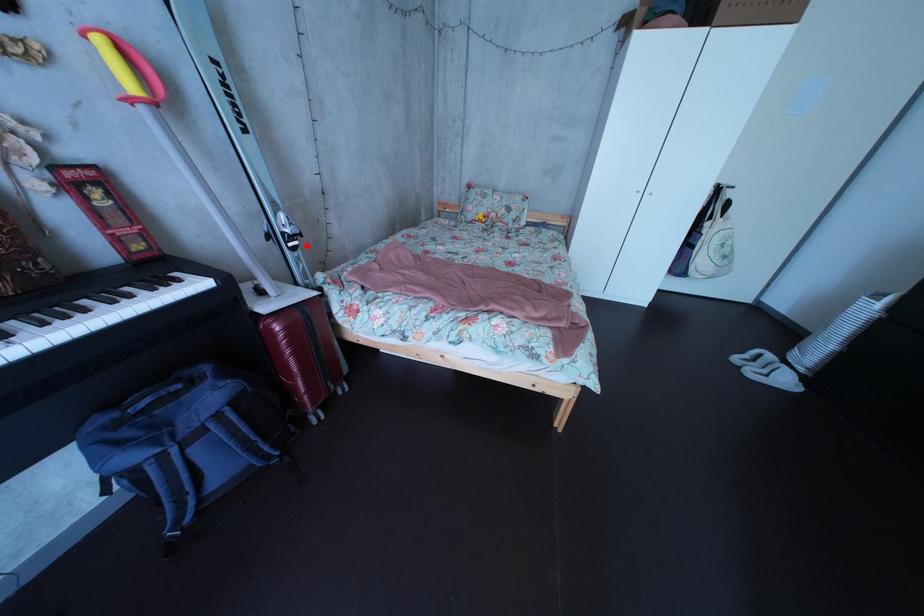
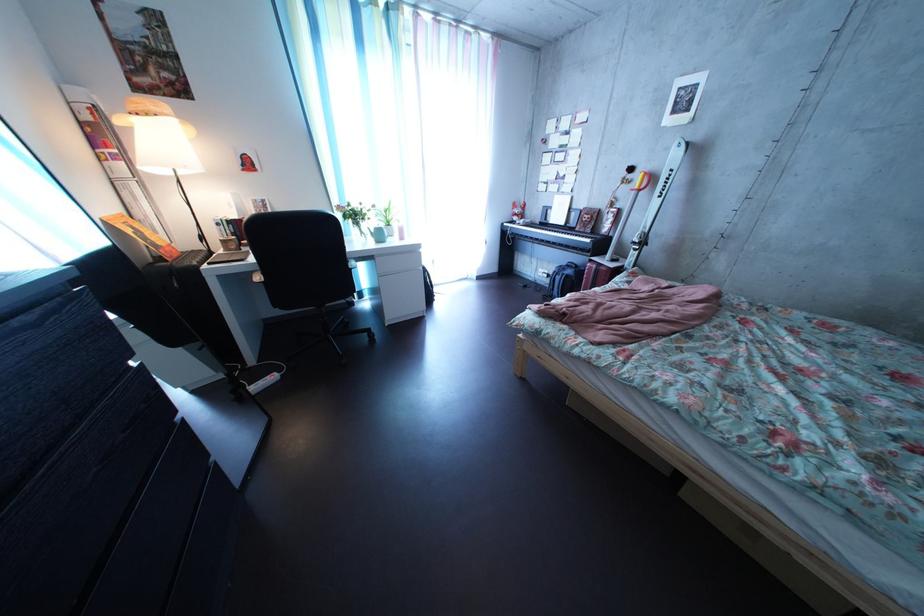
Find the pixel in the second image that matches the highlighted location in the first image.

(648, 252)